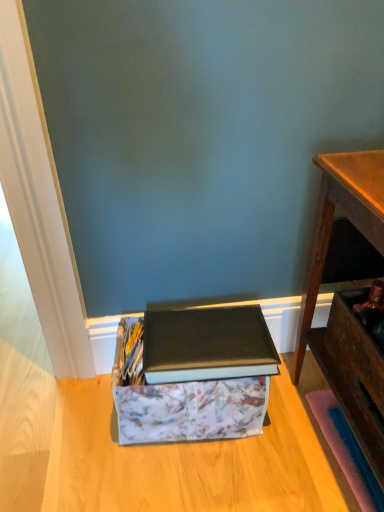
Where is `floral fabric storage box at lower center`? This screenshot has height=512, width=384. floral fabric storage box at lower center is located at coordinates (194, 375).

Is wooden drawer at lower right oriented towards matte black book at center?

Answer: No, wooden drawer at lower right does not turn towards matte black book at center.

From a real-world perspective, is wooden drawer at lower right located beneath matte black book at center?

No.

Would you say wooden drawer at lower right contains matte black book at center?

No, matte black book at center is not a part of wooden drawer at lower right.

Can you confirm if wooden drawer at lower right is thinner than matte black book at center?

Yes, wooden drawer at lower right is thinner than matte black book at center.

Is wooden desk at right facing away from matte black book at center?

That's not correct — wooden desk at right is not looking away from matte black book at center.

Is wooden desk at right closer to the viewer compared to matte black book at center?

Yes, it is in front of matte black book at center.

Considering the relative sizes of wooden desk at right and matte black book at center in the image provided, is wooden desk at right wider than matte black book at center?

Indeed, wooden desk at right has a greater width compared to matte black book at center.

Does point (304, 288) come behind point (153, 318)?

Yes, point (304, 288) is behind point (153, 318).

From the image's perspective, which object appears higher, matte black book at center or floral fabric storage box at lower center?

matte black book at center is shown above in the image.

Is matte black book at center aimed at floral fabric storage box at lower center?

No, matte black book at center is not aimed at floral fabric storage box at lower center.

Is matte black book at center closer to camera compared to floral fabric storage box at lower center?

Yes, the depth of matte black book at center is less than that of floral fabric storage box at lower center.

How many degrees apart are the facing directions of matte black book at center and floral fabric storage box at lower center?

They differ by 0.0179 degrees in their facing directions.

Considering the points (125, 418) and (266, 355), which point is in front, point (125, 418) or point (266, 355)?

Point (266, 355)

Which is more to the left, floral fabric storage box at lower center or matte black book at center?

From the viewer's perspective, floral fabric storage box at lower center appears more on the left side.

Is floral fabric storage box at lower center facing away from matte black book at center?

floral fabric storage box at lower center is not turned away from matte black book at center.

Is floral fabric storage box at lower center inside the boundaries of matte black book at center, or outside?

floral fabric storage box at lower center lies outside matte black book at center.

Is floral fabric storage box at lower center aimed at wooden desk at right?

No, floral fabric storage box at lower center is not oriented towards wooden desk at right.

Based on the photo, is wooden desk at right completely or partially inside floral fabric storage box at lower center?

No, wooden desk at right is located outside of floral fabric storage box at lower center.

Between point (200, 421) and point (380, 415), which one is positioned behind?

The point (200, 421) is more distant.

Between wooden drawer at lower right and floral fabric storage box at lower center, which one has less height?

With less height is floral fabric storage box at lower center.

Considering the positions of objects wooden drawer at lower right and floral fabric storage box at lower center in the image provided, who is more to the right, wooden drawer at lower right or floral fabric storage box at lower center?

A: wooden drawer at lower right.

From the image's perspective, which is above, wooden drawer at lower right or floral fabric storage box at lower center?

wooden drawer at lower right, from the image's perspective.

Is wooden drawer at lower right bigger than floral fabric storage box at lower center?

Actually, wooden drawer at lower right might be smaller than floral fabric storage box at lower center.

From a real-world perspective, is floral fabric storage box at lower center physically located above or below wooden drawer at lower right?

floral fabric storage box at lower center is below wooden drawer at lower right.

Is floral fabric storage box at lower center positioned before wooden drawer at lower right?

No, the depth of floral fabric storage box at lower center is greater than that of wooden drawer at lower right.

Are floral fabric storage box at lower center and wooden drawer at lower right far apart?

No.

From the image's perspective, which object appears higher, floral fabric storage box at lower center or wooden drawer at lower right?

wooden drawer at lower right appears higher in the image.

Find the location of a particular element. This screenshot has width=384, height=512. paperback book that appears below the wooden drawer at lower right (from the image's perspective) is located at coordinates coord(207,344).

At what (x,y) coordinates should I click in order to perform the action: click on paperback book directly beneath the wooden desk at right (from a real-world perspective). Please return your answer as a coordinate pair (x, y). This screenshot has height=512, width=384. Looking at the image, I should click on (207, 344).

Looking at the image, which one is located further to wooden drawer at lower right, matte black book at center or floral fabric storage box at lower center?

floral fabric storage box at lower center is further to wooden drawer at lower right.

When comparing their distances from floral fabric storage box at lower center, does matte black book at center or wooden desk at right seem further?

Based on the image, wooden desk at right appears to be further to floral fabric storage box at lower center.

When comparing their distances from floral fabric storage box at lower center, does wooden desk at right or wooden drawer at lower right seem closer?

The object closer to floral fabric storage box at lower center is wooden desk at right.

When comparing their distances from matte black book at center, does wooden drawer at lower right or wooden desk at right seem further?

The object further to matte black book at center is wooden desk at right.

Which object lies further to the anchor point matte black book at center, wooden desk at right or floral fabric storage box at lower center?

The object further to matte black book at center is wooden desk at right.

In the scene shown: Which object lies nearer to the anchor point wooden desk at right, wooden drawer at lower right or floral fabric storage box at lower center?

Among the two, wooden drawer at lower right is located nearer to wooden desk at right.

Estimate the real-world distances between objects in this image. Which object is closer to matte black book at center, floral fabric storage box at lower center or wooden desk at right?

floral fabric storage box at lower center is closer to matte black book at center.

Based on their spatial positions, is floral fabric storage box at lower center or wooden desk at right further from wooden drawer at lower right?

Based on the image, floral fabric storage box at lower center appears to be further to wooden drawer at lower right.

Locate an element on the screen. This screenshot has width=384, height=512. drawer between wooden desk at right and matte black book at center in the front-back direction is located at coordinates (355, 348).

Find the location of a particular element. Image resolution: width=384 pixels, height=512 pixels. paperback book positioned between wooden desk at right and floral fabric storage box at lower center from near to far is located at coordinates click(207, 344).

The height and width of the screenshot is (512, 384). In order to click on drawer between floral fabric storage box at lower center and wooden desk at right in the horizontal direction in this screenshot , I will do `click(355, 348)`.

The height and width of the screenshot is (512, 384). I want to click on paperback book located between floral fabric storage box at lower center and wooden drawer at lower right in the left-right direction, so tap(207, 344).